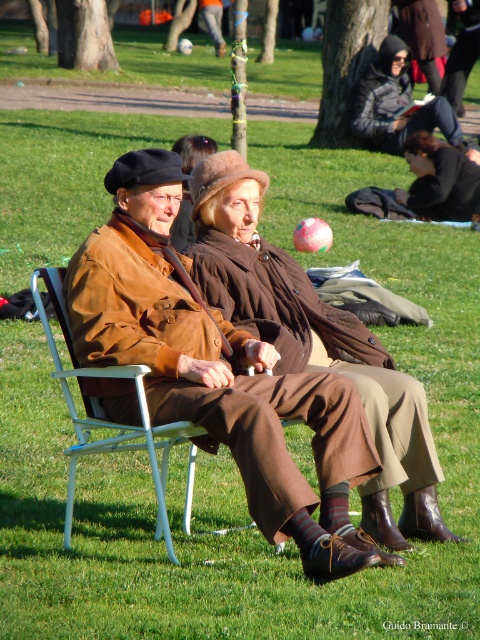
Is dark gray hooded jacket at center smaller than brown woolen coat at center?

No, dark gray hooded jacket at center is not smaller than brown woolen coat at center.

Can you confirm if dark gray hooded jacket at center is taller than brown woolen coat at center?

Correct, dark gray hooded jacket at center is much taller as brown woolen coat at center.

Identify the location of dark gray hooded jacket at center. The image size is (480, 640). (397, 104).

Which is more to the left, brown suede jacket at center or dark brown leather jacket at lower right?

brown suede jacket at center is more to the left.

Is point (79, 304) less distant than point (410, 150)?

Yes, point (79, 304) is in front of point (410, 150).

Find the location of a particular element. The width and height of the screenshot is (480, 640). brown suede jacket at center is located at coordinates (216, 369).

Image resolution: width=480 pixels, height=640 pixels. What are the coordinates of `dark gray hooded jacket at center` in the screenshot? It's located at (397, 104).

From the picture: Can you confirm if dark gray hooded jacket at center is taller than dark brown leather jacket at lower right?

Correct, dark gray hooded jacket at center is much taller as dark brown leather jacket at lower right.

Measure the distance between dark gray hooded jacket at center and camera.

dark gray hooded jacket at center and camera are 15.37 meters apart.

Where is `dark gray hooded jacket at center`? This screenshot has width=480, height=640. dark gray hooded jacket at center is located at coordinates (397, 104).